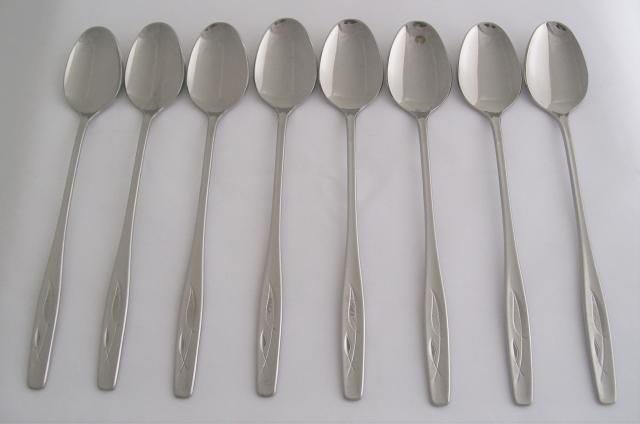
Where is `spoons`? spoons is located at coordinates (86, 83), (168, 77), (212, 80), (291, 83), (353, 78), (424, 75), (496, 83), (564, 74).